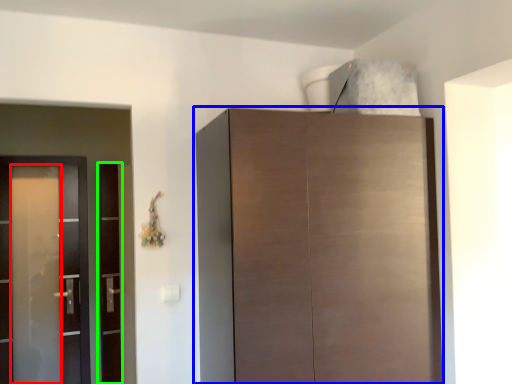
Question: Which object is the closest to the screen door (highlighted by a red box)? Choose among these: cupboard (highlighted by a blue box) or screen door (highlighted by a green box).

Choices:
 (A) cupboard
 (B) screen door

Answer: (B)